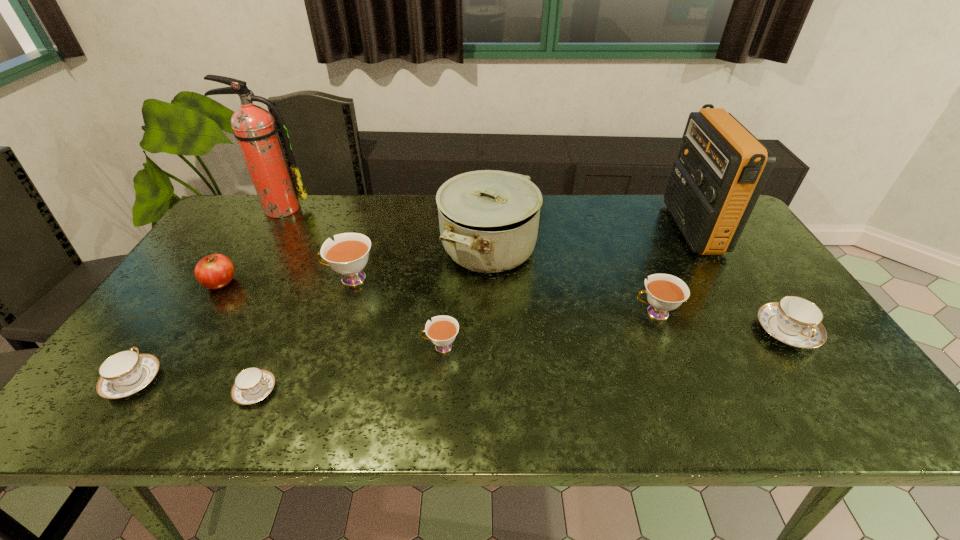
Locate an element on the screen. The height and width of the screenshot is (540, 960). the nearest white teacup is located at coordinates (442, 331).

The width and height of the screenshot is (960, 540). I want to click on the smallest white teacup, so click(x=442, y=331).

Find the location of a particular element. the leftmost teacup is located at coordinates (127, 372).

You are a GUI agent. You are given a task and a screenshot of the screen. Output one action in this format:
    pyautogui.click(x=<x>, y=<y>)
    Task: Click on the second smallest blue teacup
    The width and height of the screenshot is (960, 540).
    Given the screenshot: What is the action you would take?
    pyautogui.click(x=127, y=372)

At what (x,y) coordinates should I click in order to perform the action: click on the second blue teacup from right to left. Please return your answer as a coordinate pair (x, y). Looking at the image, I should click on (251, 385).

You are a GUI agent. You are given a task and a screenshot of the screen. Output one action in this format:
    pyautogui.click(x=<x>, y=<y>)
    Task: Click on the fourth object from left to right
    The image size is (960, 540).
    Given the screenshot: What is the action you would take?
    pyautogui.click(x=251, y=385)

Identify the location of blank space located 0.360m at the nozzle of the fire extinguisher. The width and height of the screenshot is (960, 540). (228, 295).

Identify the location of free space located on the front-facing side of the second tallest object. The image size is (960, 540). (552, 228).

Where is `vacant space located 0.130m on the front-facing side of the second tallest object`? This screenshot has height=540, width=960. vacant space located 0.130m on the front-facing side of the second tallest object is located at coordinates (634, 228).

Where is `free space located 0.050m on the front-facing side of the second tallest object`? free space located 0.050m on the front-facing side of the second tallest object is located at coordinates (659, 228).